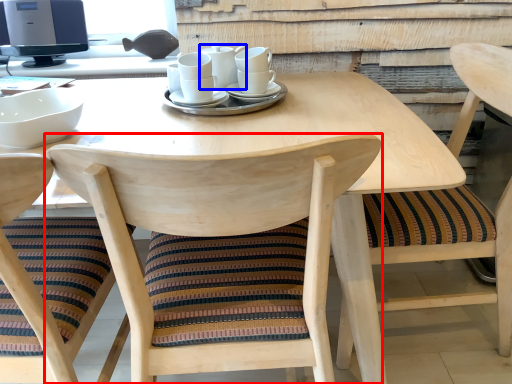
Question: Which of the following is the farthest to the observer, chair (highlighted by a red box) or tableware (highlighted by a blue box)?

Choices:
 (A) chair
 (B) tableware

Answer: (B)